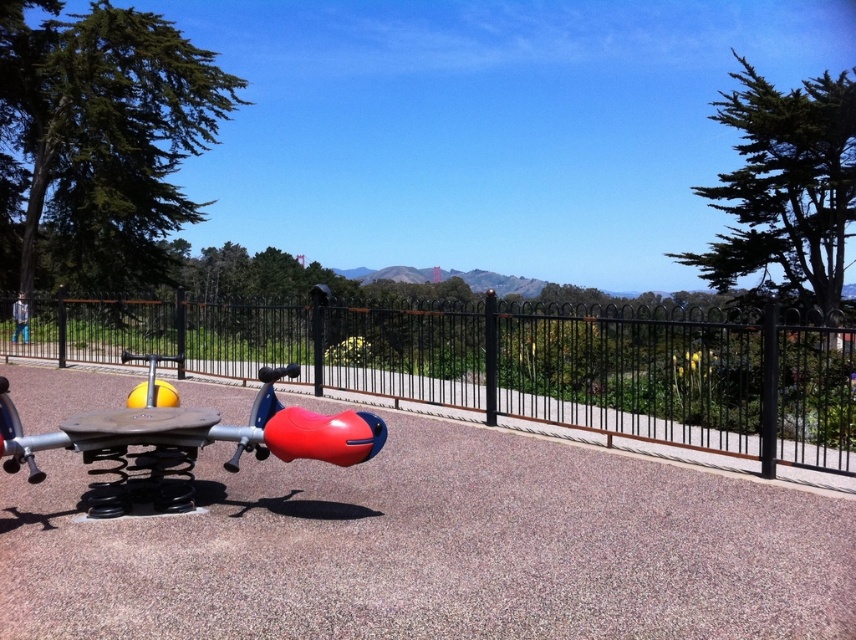
Question: Is the position of black metal fence at center more distant than that of rubberized plastic seesaw at center?

Choices:
 (A) no
 (B) yes

Answer: (B)

Question: Is black metal fence at center below rubberized plastic seesaw at center?

Choices:
 (A) yes
 (B) no

Answer: (B)

Question: Which point appears closest to the camera in this image?

Choices:
 (A) (168, 470)
 (B) (351, 387)

Answer: (A)

Question: Does black metal fence at center appear on the left side of rubberized plastic seesaw at center?

Choices:
 (A) no
 (B) yes

Answer: (A)